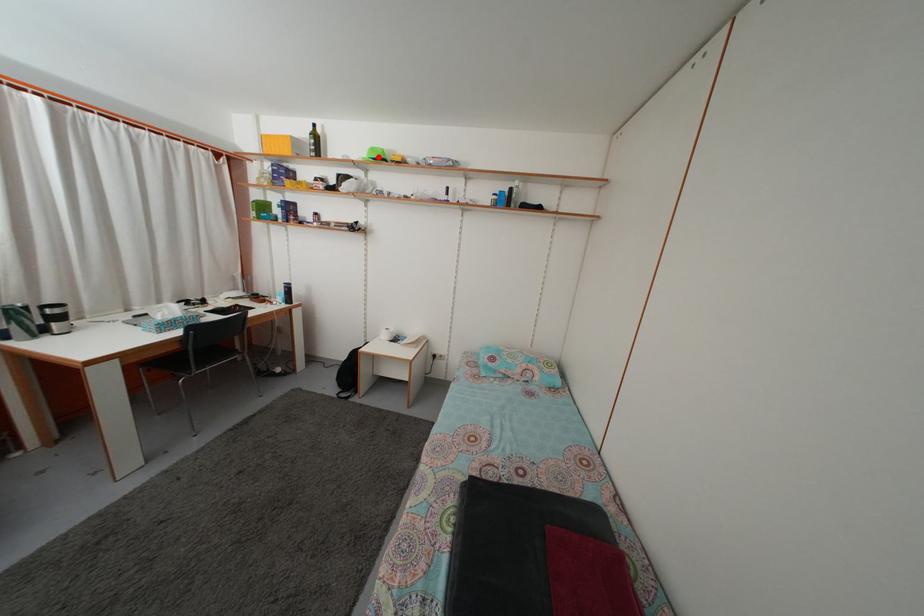
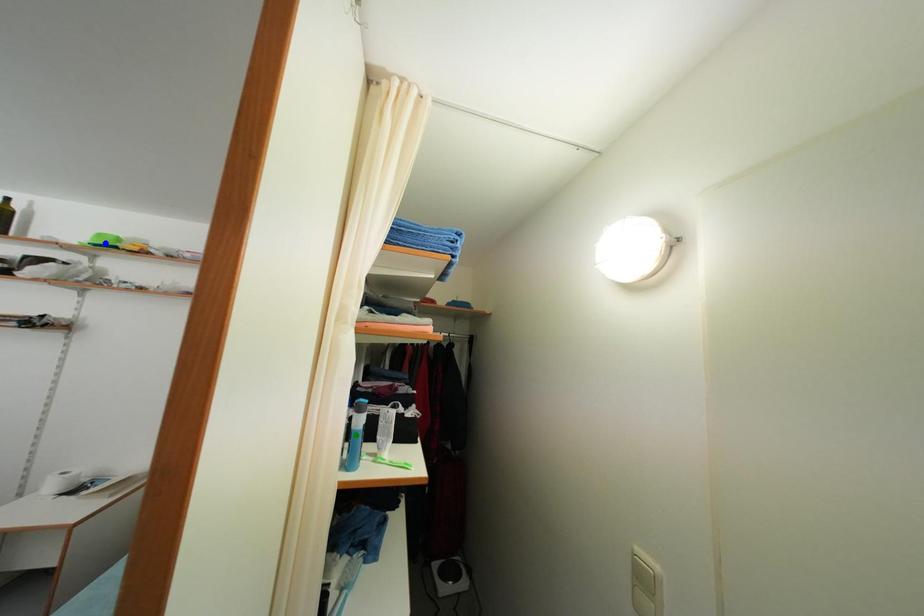
Question: I am providing you with two images of the same scene from different viewpoints. A red point is marked on the first image. You are given multiple points on the second image. In image 2, which mark is for the same physical point as the one in image 1?

Choices:
 (A) yellow point
 (B) green point
 (C) blue point

Answer: (C)